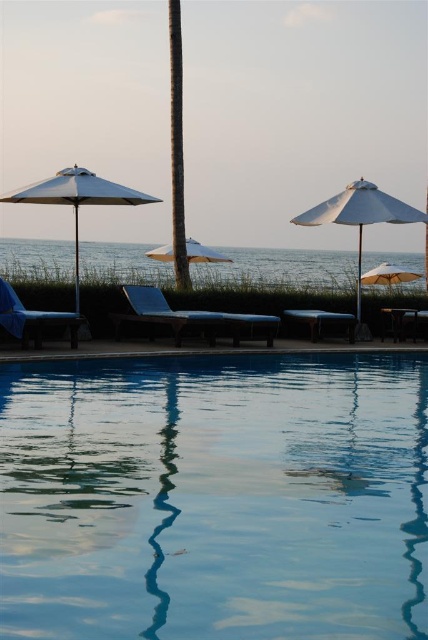
Question: Is white matte umbrella at center to the left of beige fabric umbrella at center from the viewer's perspective?

Choices:
 (A) no
 (B) yes

Answer: (A)

Question: Which object is farther from the camera taking this photo?

Choices:
 (A) beige fabric umbrella at center
 (B) brown textured pole at center
 (C) transparent glass pool at center
 (D) white matte umbrella at center

Answer: (A)

Question: Where is white matte umbrella at center located in relation to matte blue beach chair at center in the image?

Choices:
 (A) above
 (B) below

Answer: (A)

Question: Which object is the farthest from the matte blue beach chair at left?

Choices:
 (A) beige fabric umbrella at right
 (B) matte blue beach chair at center
 (C) beige fabric umbrella at center
 (D) transparent glass pool at center

Answer: (A)

Question: Which object is closer to the camera taking this photo?

Choices:
 (A) matte blue beach chair at center
 (B) transparent glass pool at center

Answer: (B)

Question: Can you confirm if white matte umbrella at left is wider than matte blue beach chair at left?

Choices:
 (A) no
 (B) yes

Answer: (B)